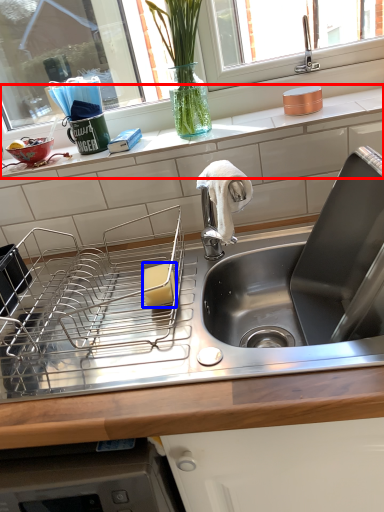
Question: Which point is closer to the camera, countertop (highlighted by a red box) or food (highlighted by a blue box)?

Choices:
 (A) countertop
 (B) food

Answer: (B)